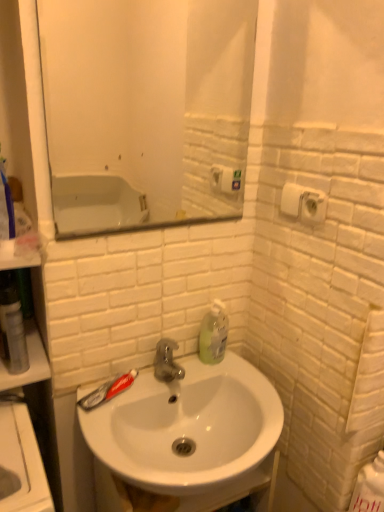
Question: Considering the relative sizes of transparent plastic mouthwash at left and white glossy sink at center in the image provided, is transparent plastic mouthwash at left bigger than white glossy sink at center?

Choices:
 (A) no
 (B) yes

Answer: (A)

Question: Does transparent plastic mouthwash at left contain white glossy sink at center?

Choices:
 (A) yes
 (B) no

Answer: (B)

Question: Is transparent plastic mouthwash at left wider than white glossy sink at center?

Choices:
 (A) no
 (B) yes

Answer: (A)

Question: Is transparent plastic mouthwash at left to the left of white glossy sink at center from the viewer's perspective?

Choices:
 (A) no
 (B) yes

Answer: (B)

Question: From the image's perspective, is transparent plastic mouthwash at left above white glossy sink at center?

Choices:
 (A) no
 (B) yes

Answer: (B)

Question: From a real-world perspective, is transparent plastic mouthwash at left below white glossy sink at center?

Choices:
 (A) yes
 (B) no

Answer: (B)

Question: Does translucent plastic toothpaste at sink left have a greater height compared to translucent plastic soap dispenser at upper right?

Choices:
 (A) yes
 (B) no

Answer: (B)

Question: From a real-world perspective, is translucent plastic toothpaste at sink left beneath translucent plastic soap dispenser at upper right?

Choices:
 (A) no
 (B) yes

Answer: (B)

Question: From the image's perspective, is translucent plastic toothpaste at sink left on translucent plastic soap dispenser at upper right?

Choices:
 (A) no
 (B) yes

Answer: (A)

Question: Is translucent plastic toothpaste at sink left facing away from translucent plastic soap dispenser at upper right?

Choices:
 (A) no
 (B) yes

Answer: (A)

Question: Is translucent plastic toothpaste at sink left at the left side of translucent plastic soap dispenser at upper right?

Choices:
 (A) no
 (B) yes

Answer: (B)

Question: Does translucent plastic toothpaste at sink left turn towards translucent plastic soap dispenser at upper right?

Choices:
 (A) yes
 (B) no

Answer: (B)

Question: From the image's perspective, is translucent plastic soap dispenser at upper right below white glossy sink at center?

Choices:
 (A) yes
 (B) no

Answer: (B)